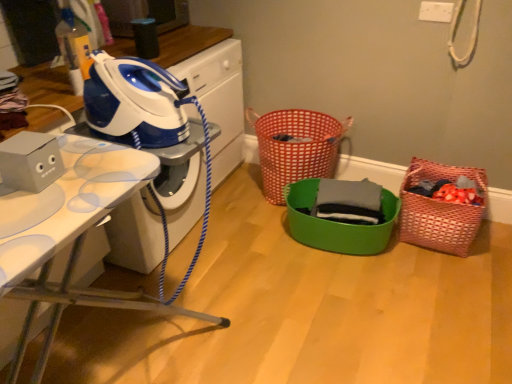
Identify the location of vacant space situated on the left part of red woven basket at center, the third basket positioned from the right. The image size is (512, 384). (239, 196).